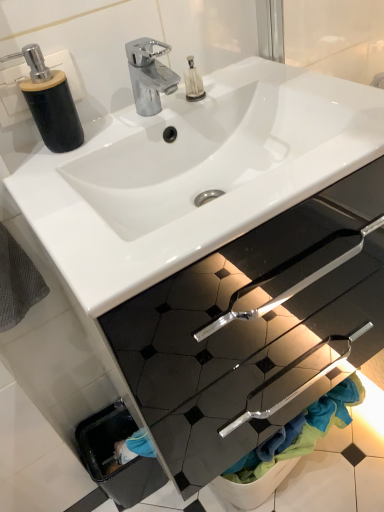
Question: Is point (31, 71) closer or farther from the camera than point (180, 217)?

Choices:
 (A) farther
 (B) closer

Answer: (B)

Question: From a real-world perspective, is matte black soap dispenser at upper left positioned above or below white glossy sink at center?

Choices:
 (A) below
 (B) above

Answer: (B)

Question: Which is farther from the white glossy sink at center?

Choices:
 (A) gray textured towel at lower left
 (B) matte black soap dispenser at upper left

Answer: (A)

Question: Based on their relative distances, which object is farther from the white glossy sink at center?

Choices:
 (A) gray textured towel at lower left
 (B) matte black soap dispenser at upper left

Answer: (A)